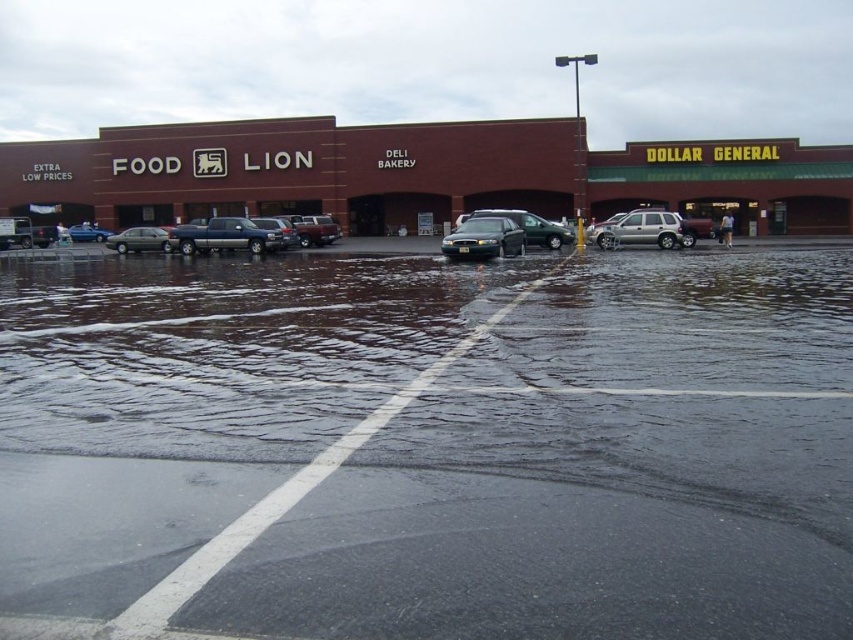
Question: Considering the real-world distances, which object is closest to the metallic silver suv at center?

Choices:
 (A) matte silver sedan at left
 (B) satin black sedan at center
 (C) black wet pavement at center
 (D) satin silver truck at center

Answer: (D)

Question: Does shiny silver sedan at center have a lesser width compared to matte gray sedan at left?

Choices:
 (A) no
 (B) yes

Answer: (B)

Question: Estimate the real-world distances between objects in this image. Which object is farther from the metallic silver suv at center?

Choices:
 (A) satin silver truck at center
 (B) brown brick building at center
 (C) matte silver sedan at left

Answer: (C)

Question: Which object is positioned farthest from the matte silver sedan at left?

Choices:
 (A) satin black sedan at center
 (B) brown brick building at center

Answer: (A)

Question: Does satin silver sedan at center appear on the right side of matte silver sedan at left?

Choices:
 (A) no
 (B) yes

Answer: (B)

Question: Is brown brick building at center closer to the viewer compared to satin silver sedan at center?

Choices:
 (A) no
 (B) yes

Answer: (A)